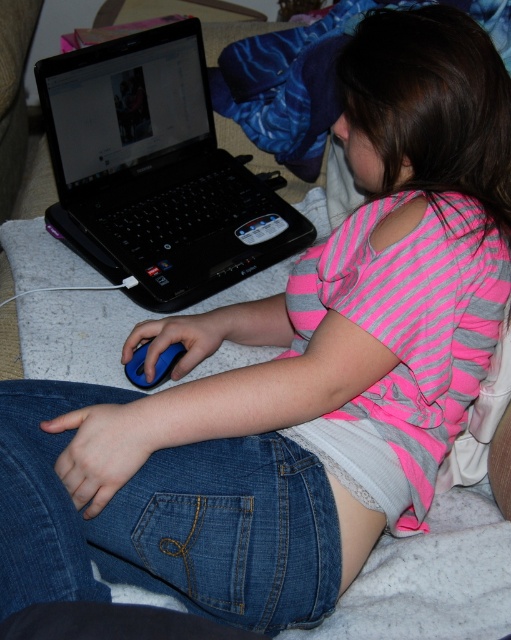
Question: Considering the relative positions of denim at lower center and black plastic laptop at upper left in the image provided, where is denim at lower center located with respect to black plastic laptop at upper left?

Choices:
 (A) below
 (B) above

Answer: (A)

Question: Which point appears farthest from the camera in this image?

Choices:
 (A) (63, 157)
 (B) (19, 572)

Answer: (A)

Question: Does black plastic laptop at upper left have a larger size compared to blue rubber mouse at lower left?

Choices:
 (A) no
 (B) yes

Answer: (B)

Question: Among these objects, which one is nearest to the camera?

Choices:
 (A) black plastic laptop at upper left
 (B) blue rubber mouse at lower left
 (C) denim at lower center

Answer: (C)

Question: Is denim at lower center thinner than blue rubber mouse at lower left?

Choices:
 (A) yes
 (B) no

Answer: (B)

Question: Which object is farther from the camera taking this photo?

Choices:
 (A) black plastic laptop at upper left
 (B) blue rubber mouse at lower left

Answer: (A)